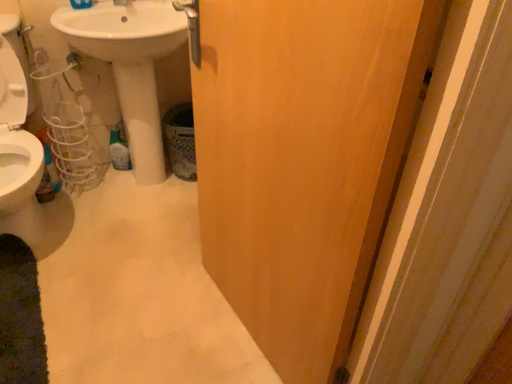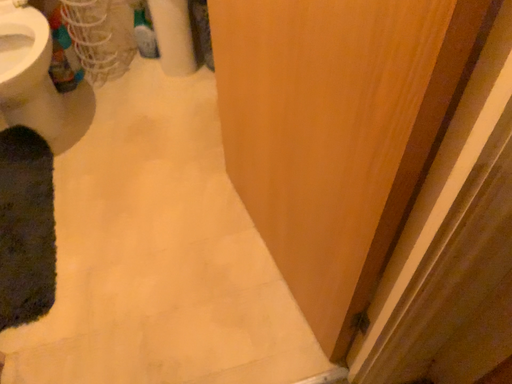
Question: Which way did the camera rotate in the video?

Choices:
 (A) rotated downward
 (B) rotated upward

Answer: (A)